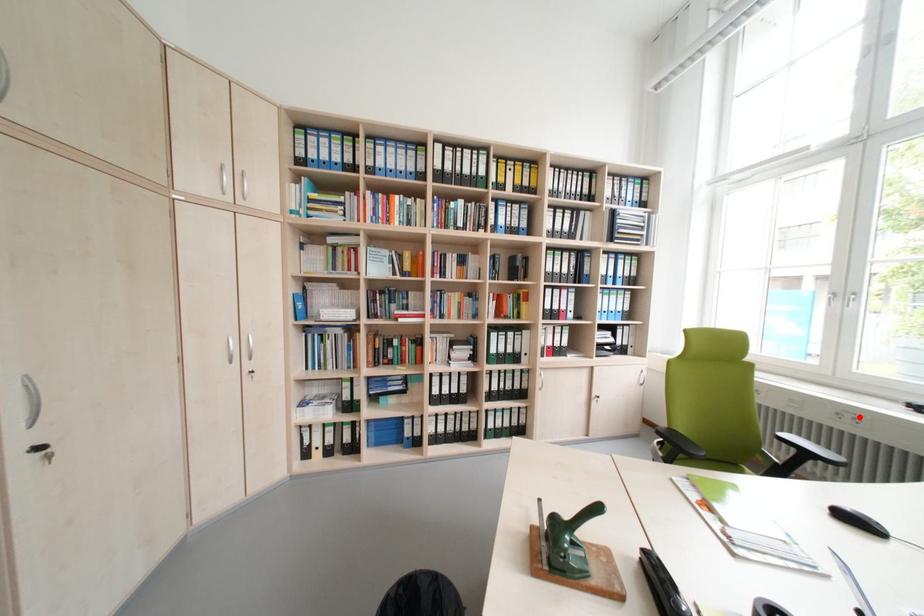
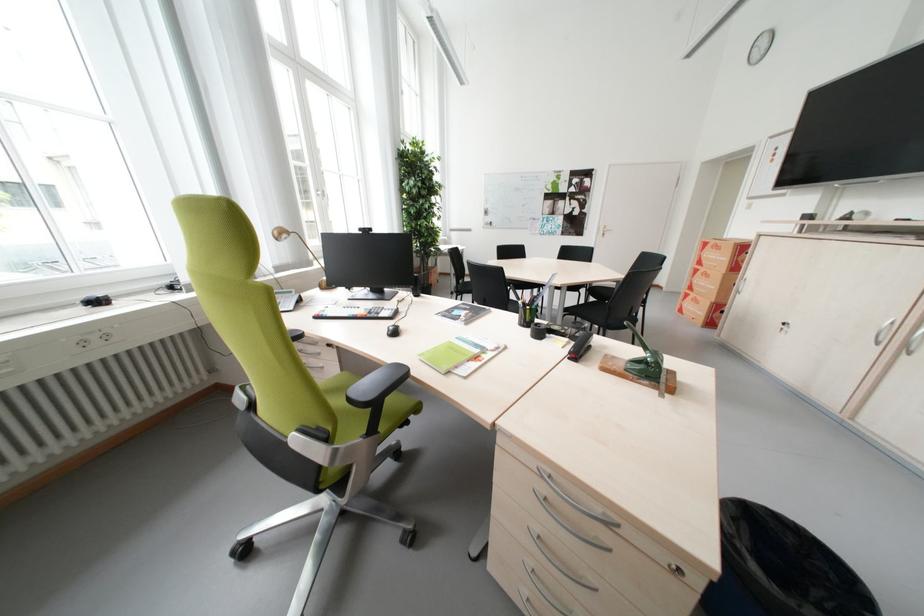
Find the pixel in the second image that matches the highlighted location in the first image.

(104, 339)